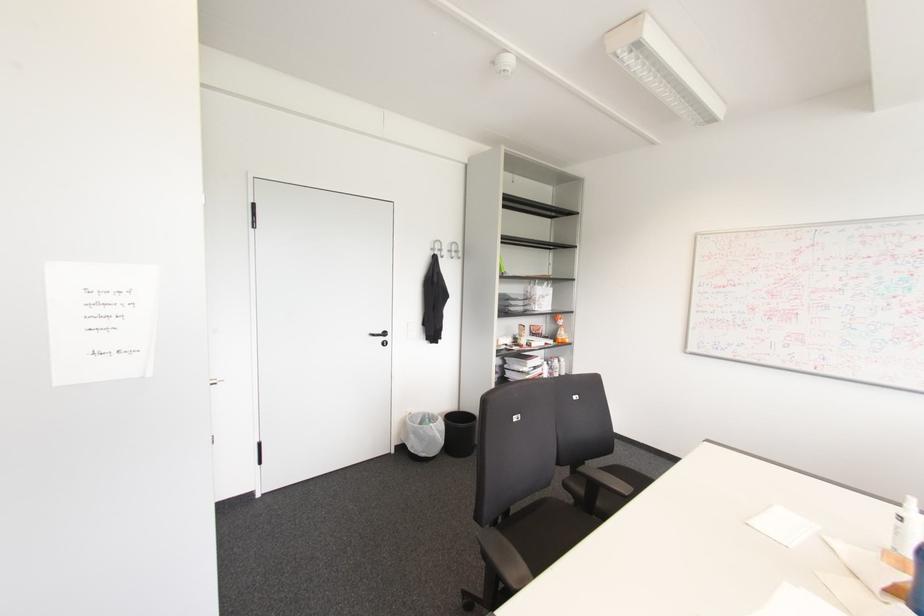
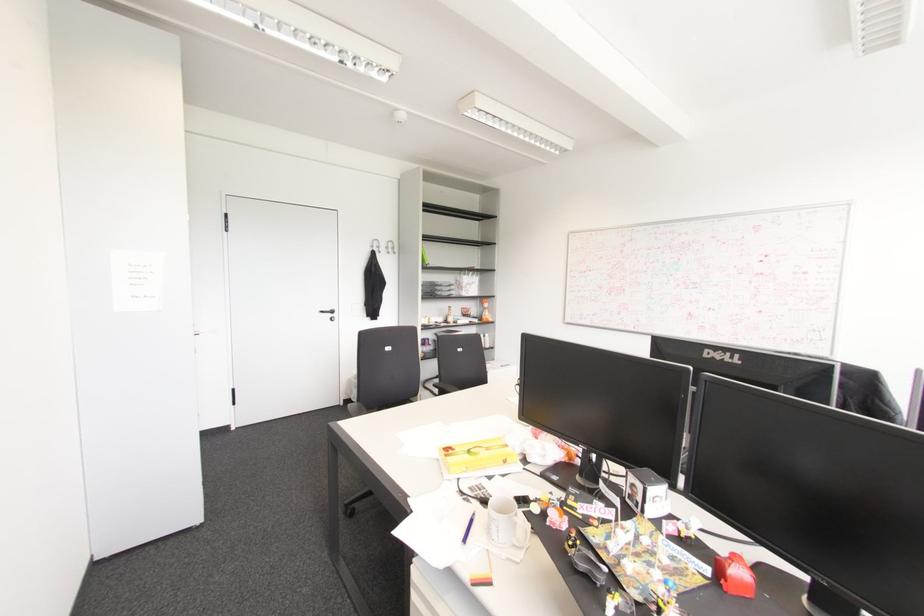
Where in the second image is the point corresponding to (x=383, y=333) from the first image?

(332, 310)